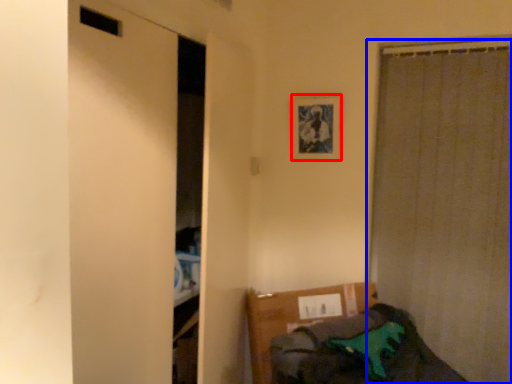
Question: Which object appears closest to the camera in this image, picture frame (highlighted by a red box) or curtain (highlighted by a blue box)?

Choices:
 (A) picture frame
 (B) curtain

Answer: (B)